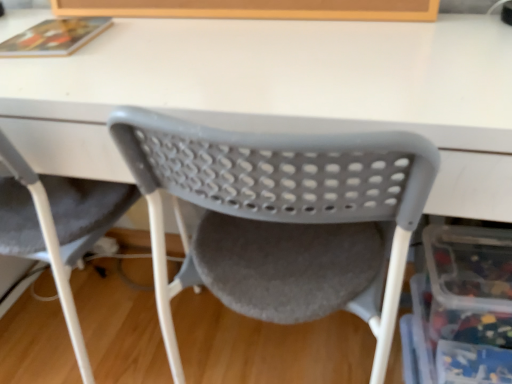
Question: Is matte plastic chair at center, the first chair positioned from the right, smaller than translucent plastic storage box at lower right?

Choices:
 (A) no
 (B) yes

Answer: (A)

Question: Is the depth of matte plastic chair at center, the 2th chair positioned from the left, greater than that of translucent plastic storage box at lower right?

Choices:
 (A) no
 (B) yes

Answer: (A)

Question: From the image's perspective, does matte plastic chair at center, the 2th chair positioned from the left, appear higher than translucent plastic storage box at lower right?

Choices:
 (A) no
 (B) yes

Answer: (B)

Question: Is matte plastic chair at center, the first chair positioned from the right, to the right of translucent plastic storage box at lower right from the viewer's perspective?

Choices:
 (A) no
 (B) yes

Answer: (A)

Question: Considering the relative positions of matte plastic chair at center, the first chair positioned from the right, and translucent plastic storage box at lower right in the image provided, is matte plastic chair at center, the first chair positioned from the right, in front of translucent plastic storage box at lower right?

Choices:
 (A) yes
 (B) no

Answer: (A)

Question: Would you say matte plastic chair at center, the 2th chair positioned from the left, is to the left or to the right of translucent plastic storage box at lower right in the picture?

Choices:
 (A) right
 (B) left

Answer: (B)

Question: From a real-world perspective, is matte plastic chair at center, the first chair positioned from the right, physically located above or below translucent plastic storage box at lower right?

Choices:
 (A) above
 (B) below

Answer: (A)

Question: Based on their sizes in the image, would you say matte plastic chair at center, the 2th chair positioned from the left, is bigger or smaller than translucent plastic storage box at lower right?

Choices:
 (A) small
 (B) big

Answer: (B)

Question: Is point (237, 142) positioned closer to the camera than point (442, 334)?

Choices:
 (A) farther
 (B) closer

Answer: (B)

Question: From a real-world perspective, relative to matte plastic chair at center, the 2th chair positioned from the left, is gray plastic chair at lower left, acting as the first chair starting from the left, vertically above or below?

Choices:
 (A) above
 (B) below

Answer: (B)

Question: Considering the positions of gray plastic chair at lower left, marked as the second chair in a right-to-left arrangement, and matte plastic chair at center, the 2th chair positioned from the left, in the image, is gray plastic chair at lower left, marked as the second chair in a right-to-left arrangement, taller or shorter than matte plastic chair at center, the 2th chair positioned from the left,?

Choices:
 (A) short
 (B) tall

Answer: (A)

Question: Is gray plastic chair at lower left, acting as the first chair starting from the left, spatially inside matte plastic chair at center, the first chair positioned from the right, or outside of it?

Choices:
 (A) outside
 (B) inside

Answer: (A)

Question: From the image's perspective, relative to matte plastic chair at center, the first chair positioned from the right, is gray plastic chair at lower left, acting as the first chair starting from the left, above or below?

Choices:
 (A) below
 (B) above

Answer: (B)

Question: Looking at the image, does matte plastic chair at center, the first chair positioned from the right, seem bigger or smaller compared to gray plastic chair at lower left, marked as the second chair in a right-to-left arrangement?

Choices:
 (A) small
 (B) big

Answer: (B)

Question: Would you say matte plastic chair at center, the 2th chair positioned from the left, is to the left or to the right of gray plastic chair at lower left, marked as the second chair in a right-to-left arrangement, in the picture?

Choices:
 (A) right
 (B) left

Answer: (A)